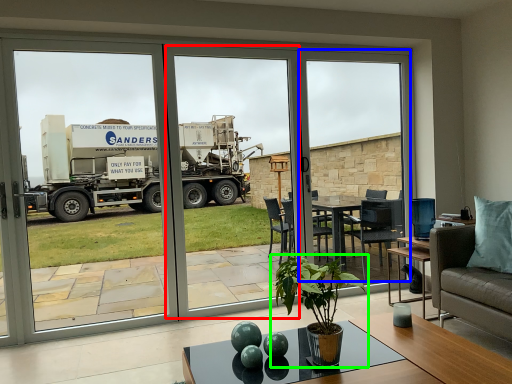
Question: Which object is the closest to the screen door (highlighted by a red box)? Choose among these: window screen (highlighted by a blue box) or houseplant (highlighted by a green box).

Choices:
 (A) window screen
 (B) houseplant

Answer: (A)